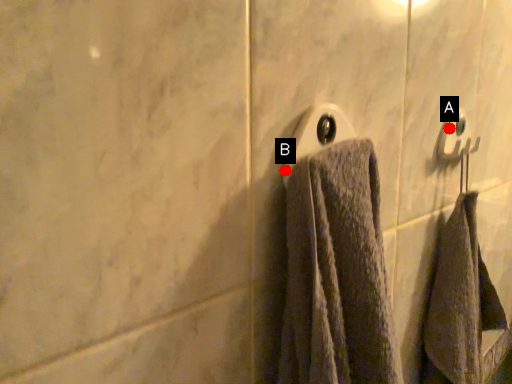
Question: Two points are circled on the image, labeled by A and B beside each circle. Among these points, which one is nearest to the camera?

Choices:
 (A) A is closer
 (B) B is closer

Answer: (B)